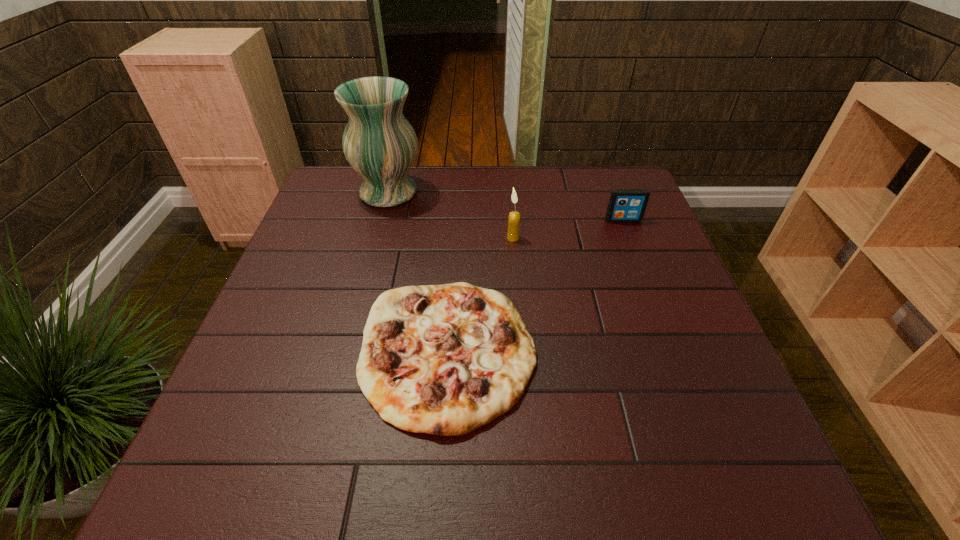
You are a GUI agent. You are given a task and a screenshot of the screen. Output one action in this format:
    pyautogui.click(x=<x>, y=<y>)
    Task: Click on the vacant space located 0.160m on the front screen of the second farthest object
    Image resolution: width=960 pixels, height=540 pixels.
    Given the screenshot: What is the action you would take?
    pyautogui.click(x=638, y=261)

What are the coordinates of `vacant space located on the left of the nearest object` in the screenshot? It's located at (264, 351).

Locate an element on the screen. object located at the far edge is located at coordinates (379, 143).

Identify the location of object located at the left edge. This screenshot has height=540, width=960. (379, 143).

At what (x,y) coordinates should I click in order to perform the action: click on object situated at the right edge. Please return your answer as a coordinate pair (x, y). This screenshot has height=540, width=960. Looking at the image, I should click on (625, 205).

This screenshot has width=960, height=540. I want to click on object situated at the far left corner, so click(x=379, y=143).

This screenshot has height=540, width=960. I want to click on vacant space at the far edge, so click(x=582, y=207).

Image resolution: width=960 pixels, height=540 pixels. In the image, there is a desktop. In order to click on free space at the near edge in this screenshot , I will do `click(633, 449)`.

This screenshot has height=540, width=960. What are the coordinates of `free region at the left edge of the desktop` in the screenshot? It's located at (349, 229).

In the image, there is a desktop. Identify the location of vacant region at the right edge. The width and height of the screenshot is (960, 540). (621, 269).